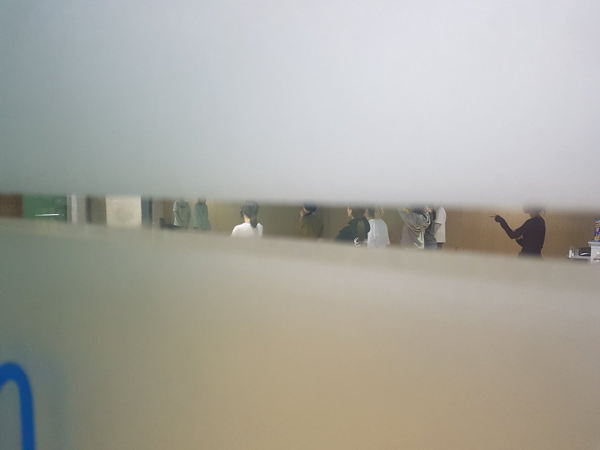
Identify the location of toaster. (584, 253).